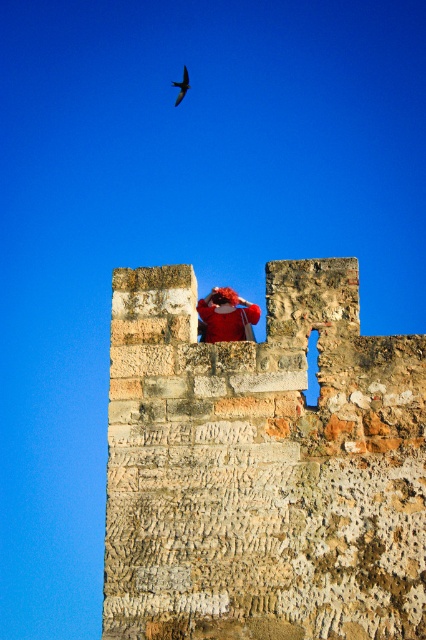
You are a drone operator trying to capture footage of the rusty stone fort at center and the smooth black bird at upper center. Your drone has a maximum camera zoom range of 300 feet. Can you capture both subjects in a single shot without moving the drone?

The rusty stone fort at center and smooth black bird at upper center are 332.17 feet apart from each other. Since the drone camera can only zoom up to 300 feet, it cannot capture both subjects in a single shot without moving the drone because the distance between them exceeds the maximum zoom range.

You are an architect analyzing the structure of the rusty stone fort at center and the smooth black bird at upper center. Which object occupies more horizontal space in the image?

The rusty stone fort at center has a greater width than the smooth black bird at upper center, so it occupies more horizontal space.